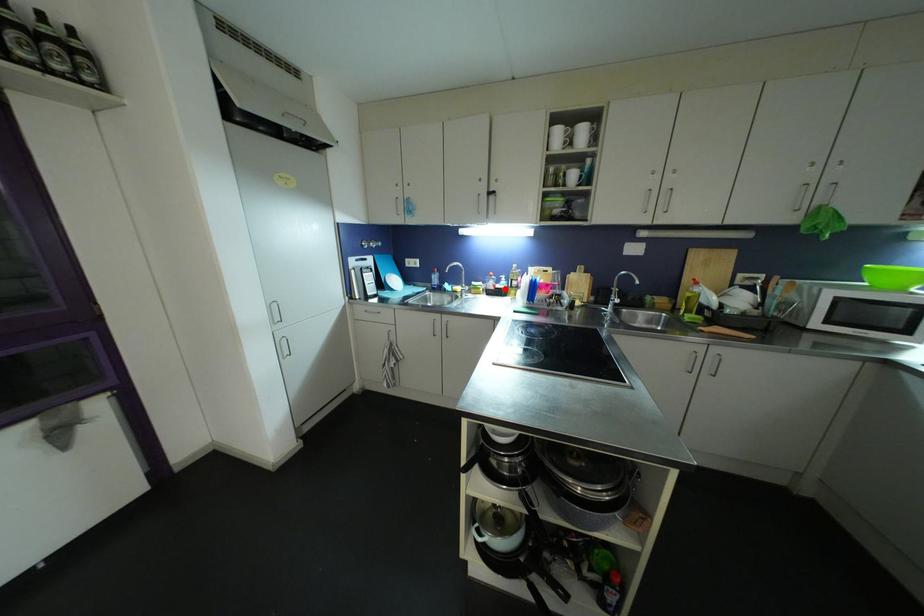
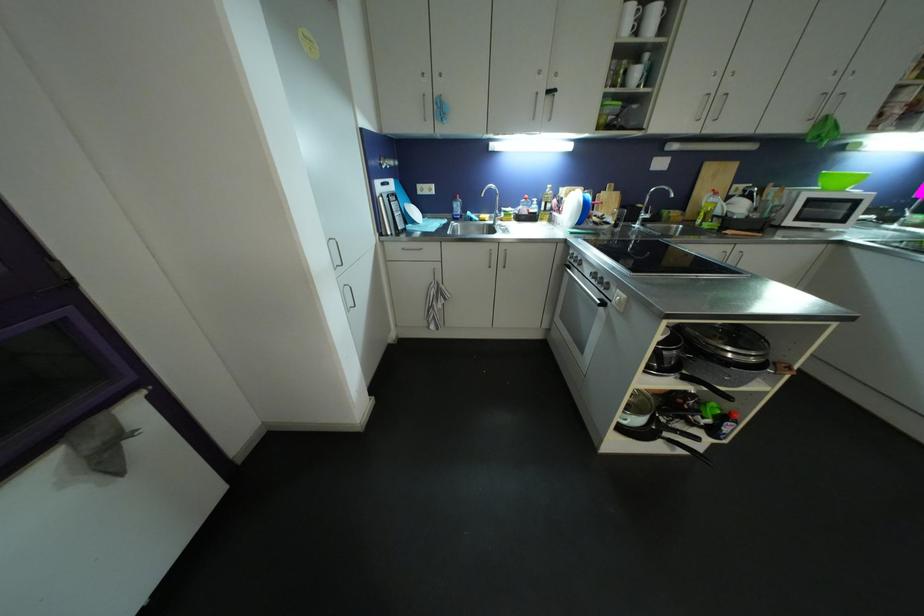
Find the pixel in the second image that matches the highlighted location in the first image.

(539, 214)